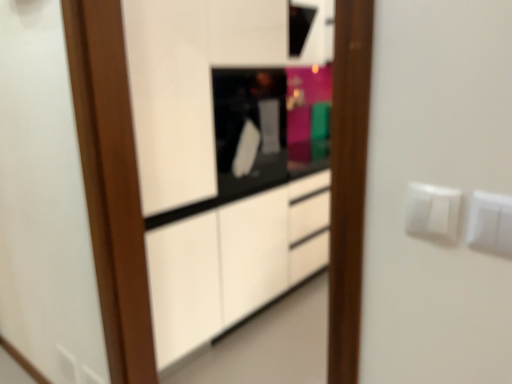
Question: Can you confirm if white plastic electric outlet at lower left, which is the third electric outlet in front-to-back order, is smaller than black glossy microwave at center?

Choices:
 (A) yes
 (B) no

Answer: (A)

Question: Does white plastic electric outlet at lower left, the 3th electric outlet positioned from the top, have a larger size compared to black glossy microwave at center?

Choices:
 (A) yes
 (B) no

Answer: (B)

Question: From a real-world perspective, is white plastic electric outlet at lower left, the 3th electric outlet positioned from the top, below black glossy microwave at center?

Choices:
 (A) no
 (B) yes

Answer: (B)

Question: Could you tell me if white plastic electric outlet at lower left, the 3th electric outlet positioned from the top, is turned towards black glossy microwave at center?

Choices:
 (A) no
 (B) yes

Answer: (A)

Question: Does white plastic electric outlet at lower left, positioned as the 1th electric outlet in left-to-right order, appear on the left side of black glossy microwave at center?

Choices:
 (A) yes
 (B) no

Answer: (A)

Question: Looking at their shapes, would you say black glossy microwave at center is wider or thinner than white plastic switch at upper right, marked as the 3th electric outlet in a bottom-to-top arrangement?

Choices:
 (A) wide
 (B) thin

Answer: (A)

Question: From their relative heights in the image, would you say black glossy microwave at center is taller or shorter than white plastic switch at upper right, the second electric outlet from the back?

Choices:
 (A) short
 (B) tall

Answer: (B)

Question: In the image, is black glossy microwave at center positioned in front of or behind white plastic switch at upper right, marked as the 3th electric outlet in a bottom-to-top arrangement?

Choices:
 (A) front
 (B) behind

Answer: (B)

Question: Is point (240, 100) positioned closer to the camera than point (444, 198)?

Choices:
 (A) farther
 (B) closer

Answer: (A)

Question: In terms of width, does white plastic switch at upper right, which ranks as the 2th electric outlet in left-to-right order, look wider or thinner when compared to black glossy microwave at center?

Choices:
 (A) thin
 (B) wide

Answer: (A)

Question: Is point coord(420,231) closer or farther from the camera than point coord(283,127)?

Choices:
 (A) farther
 (B) closer

Answer: (B)

Question: Looking at the image, does white plastic switch at upper right, positioned as the second electric outlet in right-to-left order, seem bigger or smaller compared to black glossy microwave at center?

Choices:
 (A) small
 (B) big

Answer: (A)

Question: From their relative heights in the image, would you say white plastic switch at upper right, which is the first electric outlet in top-to-bottom order, is taller or shorter than black glossy microwave at center?

Choices:
 (A) tall
 (B) short

Answer: (B)

Question: Visually, is white plastic switch at upper right, the second electric outlet from the back, positioned to the left or to the right of white plastic electric outlet at right, the second electric outlet when ordered from top to bottom?

Choices:
 (A) right
 (B) left

Answer: (B)

Question: Considering the positions of point (457, 221) and point (501, 241), is point (457, 221) closer or farther from the camera than point (501, 241)?

Choices:
 (A) farther
 (B) closer

Answer: (A)